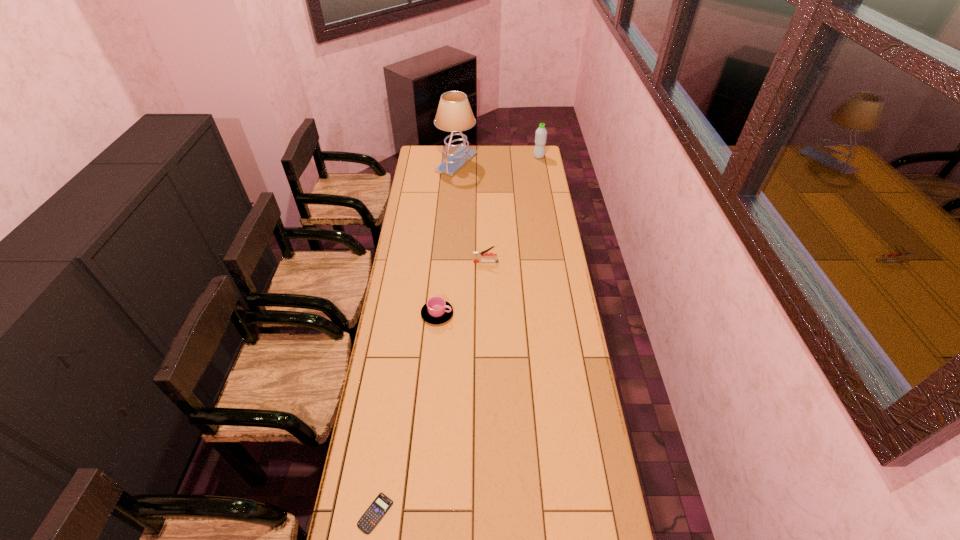
Locate an element on the screen. blank area located on the front of the water bottle is located at coordinates 546,199.

At what (x,y) coordinates should I click in order to perform the action: click on blank area located 0.210m on the handle side of the third nearest object. Please return your answer as a coordinate pair (x, y). Looking at the image, I should click on (428, 262).

You are a GUI agent. You are given a task and a screenshot of the screen. Output one action in this format:
    pyautogui.click(x=<x>, y=<y>)
    Task: Click on the free space located on the handle side of the third nearest object
    
    Given the screenshot: What is the action you would take?
    pyautogui.click(x=435, y=262)

This screenshot has width=960, height=540. In order to click on vacant point located on the handle side of the third nearest object in this screenshot , I will do `click(398, 262)`.

Find the location of a particular element. The image size is (960, 540). vacant space situated on the side with the handle of the fourth tallest object is located at coordinates (544, 314).

Locate an element on the screen. The image size is (960, 540). free space located on the right of the nearest object is located at coordinates (420, 513).

Where is `table lamp that is at the far edge`? The width and height of the screenshot is (960, 540). table lamp that is at the far edge is located at coordinates (454, 114).

Where is `water bottle that is at the far edge`? This screenshot has width=960, height=540. water bottle that is at the far edge is located at coordinates (541, 133).

The image size is (960, 540). I want to click on table lamp positioned at the left edge, so click(454, 114).

You are a GUI agent. You are given a task and a screenshot of the screen. Output one action in this format:
    pyautogui.click(x=<x>, y=<y>)
    Task: Click on the cup located at the left edge
    
    Given the screenshot: What is the action you would take?
    click(x=436, y=311)